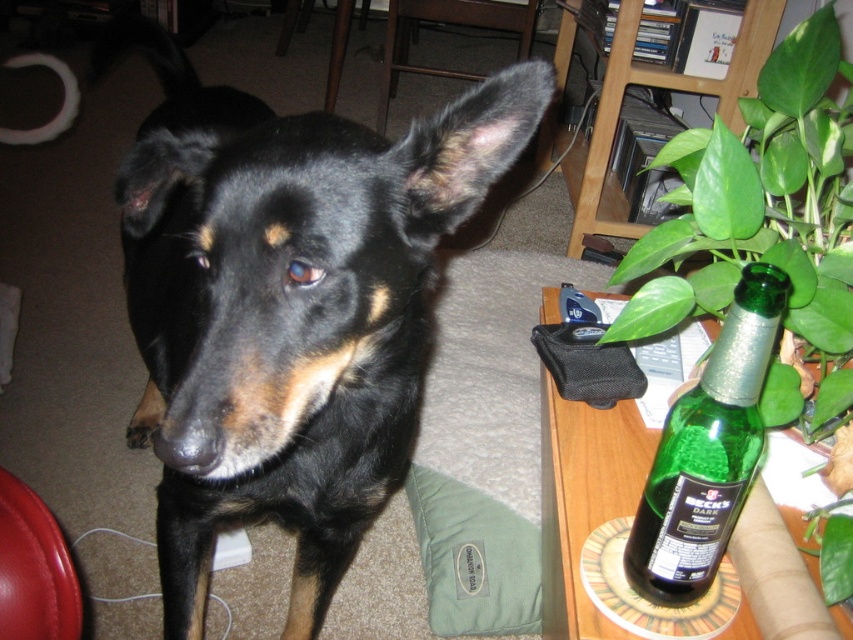
Question: Among these points, which one is farthest from the camera?

Choices:
 (A) (508, 116)
 (B) (758, 456)

Answer: (B)

Question: Considering the real-world distances, which object is closest to the green glass bottle at lower right?

Choices:
 (A) green leafy plant at right
 (B) black shiny fur dog at center

Answer: (A)

Question: Can you confirm if black shiny fur dog at center is positioned above green leafy plant at right?

Choices:
 (A) no
 (B) yes

Answer: (A)

Question: Is green leafy plant at right to the right of green glass bottle at lower right from the viewer's perspective?

Choices:
 (A) no
 (B) yes

Answer: (B)

Question: Is black shiny fur dog at center thinner than green leafy plant at right?

Choices:
 (A) yes
 (B) no

Answer: (B)

Question: Which object is closer to the camera taking this photo?

Choices:
 (A) black shiny fur dog at center
 (B) green leafy plant at right

Answer: (A)